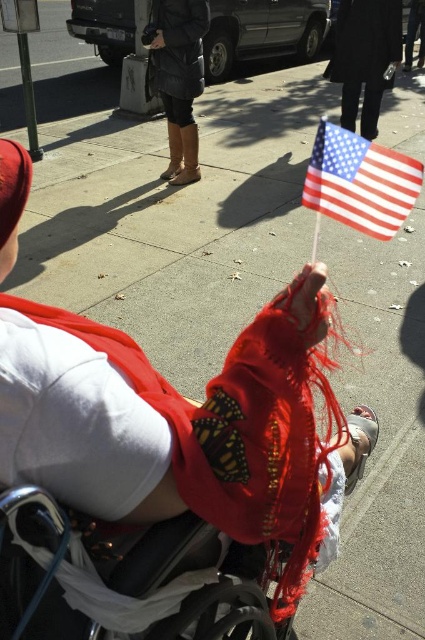
Looking at this image, you are a delivery robot with a 1.2 meter wide package. You need to move from the parked SUV to the person in the wheelchair. The path between the american flag at upper right and the leather boots at center is 4.16 meters. Can you navigate through this path with your package?

The distance between the american flag at upper right and the leather boots at center is 4.16 meters. Since the package is only 1.2 meters wide, the robot can safely navigate through the path as the distance is sufficient for movement.

You are a photographer trying to capture a clear shot of the American flag at upper right and the leather boots at center. However, you notice that one object is blocking the other. Which object is blocking the other?

The leather boots at center are blocking the American flag at upper right because the American flag at upper right is positioned under the leather boots at center.

You are standing on the sidewalk and want to place a small potted plant at point (170, 580). The plant requires a minimum of 3 feet of space from the viewer to avoid obstruction. Can you safely place it there?

The distance of point (170, 580) from viewer is 3.36 feet, so yes, you can safely place the plant there since it meets the minimum distance requirement.